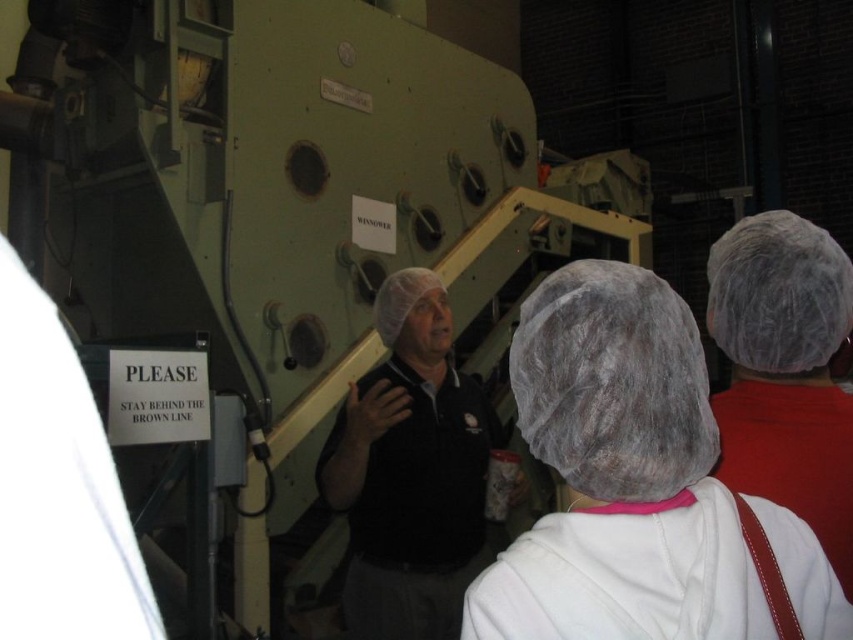
You are a tour guide in the facility and need to ensure all hairnets meet safety standards. The safety manual states that hairnets must be at least 10 cm in height. You observe the white textured hairnet at center and the white fuzzy hairnet at upper right. Which hairnet is more likely to comply with the height requirement?

The white fuzzy hairnet at upper right is taller than the white textured hairnet at center. Since the safety manual requires hairnets to be at least 10 cm in height, the white fuzzy hairnet at upper right is more likely to comply with the height requirement.

You are a tour guide at a factory and need to identify the largest object between the black matte shirt at center and the white fuzzy hairnet at upper right. Which one should you point out?

The black matte shirt at center is larger in size than the white fuzzy hairnet at upper right, so you should point out the black matte shirt at center as the largest object between them.

You are a tour guide in the facility and need to locate the white textured hairnet at center for a safety inspection. Based on the scene description, where would you find it in the image?

The white textured hairnet at center is located at the coordinates point (618, 474) in the image.